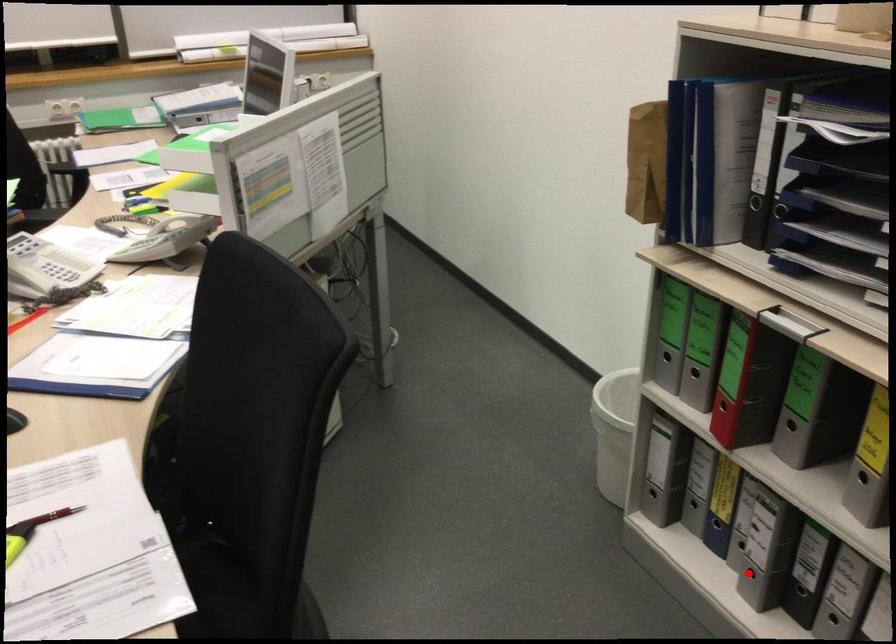
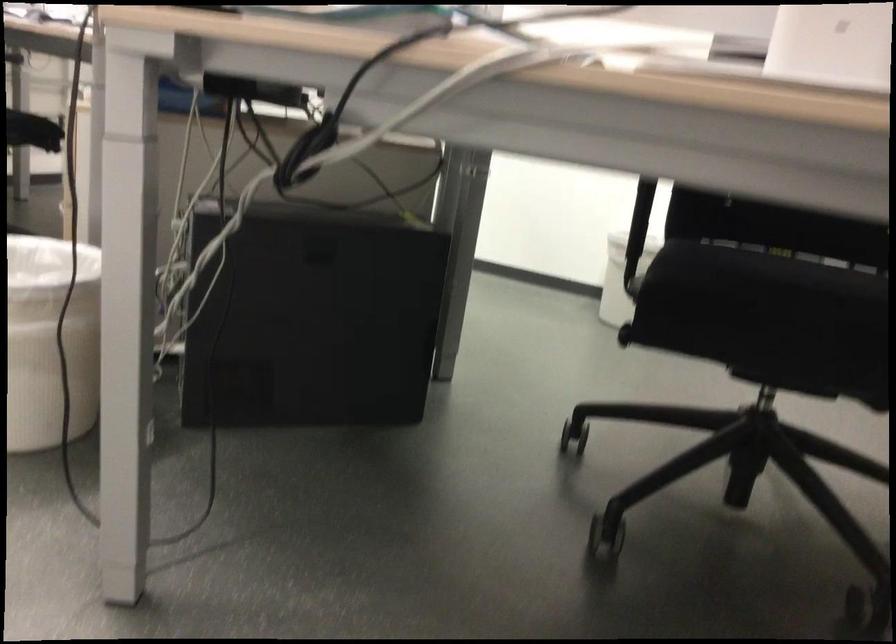
Question: I am providing you with two images of the same scene from different viewpoints. A red point is marked on the first image. At the location where the point appears in image 1, is it still visible in image 2?

Choices:
 (A) Yes
 (B) No

Answer: (B)